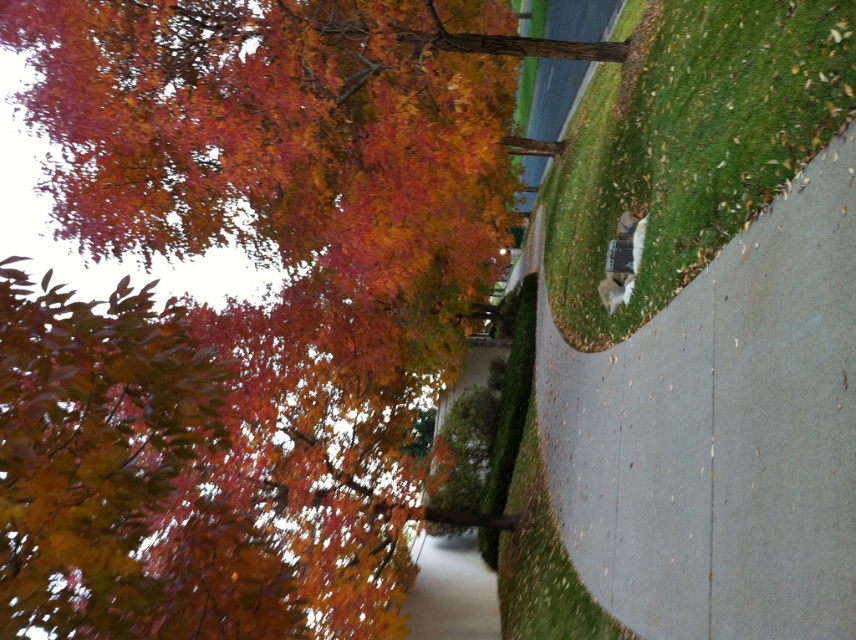
Question: Is autumn leaves at upper left below green grass at lower right?

Choices:
 (A) no
 (B) yes

Answer: (B)

Question: Among these points, which one is nearest to the camera?

Choices:
 (A) (723, 99)
 (B) (98, 220)

Answer: (A)

Question: Which point is farther to the camera?

Choices:
 (A) (569, 232)
 (B) (253, 33)

Answer: (A)

Question: From the image, what is the correct spatial relationship of autumn leaves at upper left in relation to green grass at lower right?

Choices:
 (A) below
 (B) above

Answer: (A)

Question: Which object appears closest to the camera in this image?

Choices:
 (A) autumn leaves at upper left
 (B) green grass at lower right

Answer: (A)

Question: Does autumn leaves at upper left have a larger size compared to green grass at lower right?

Choices:
 (A) no
 (B) yes

Answer: (B)